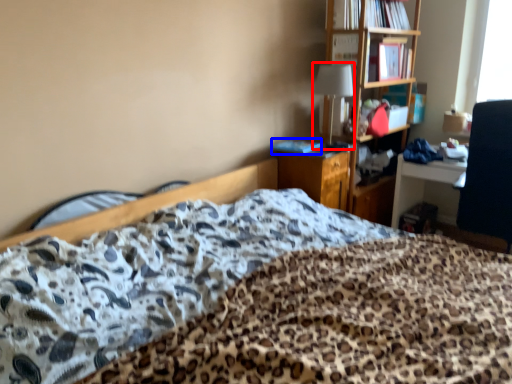
Question: Which object appears farthest to the camera in this image, table lamp (highlighted by a red box) or book (highlighted by a blue box)?

Choices:
 (A) table lamp
 (B) book

Answer: (B)